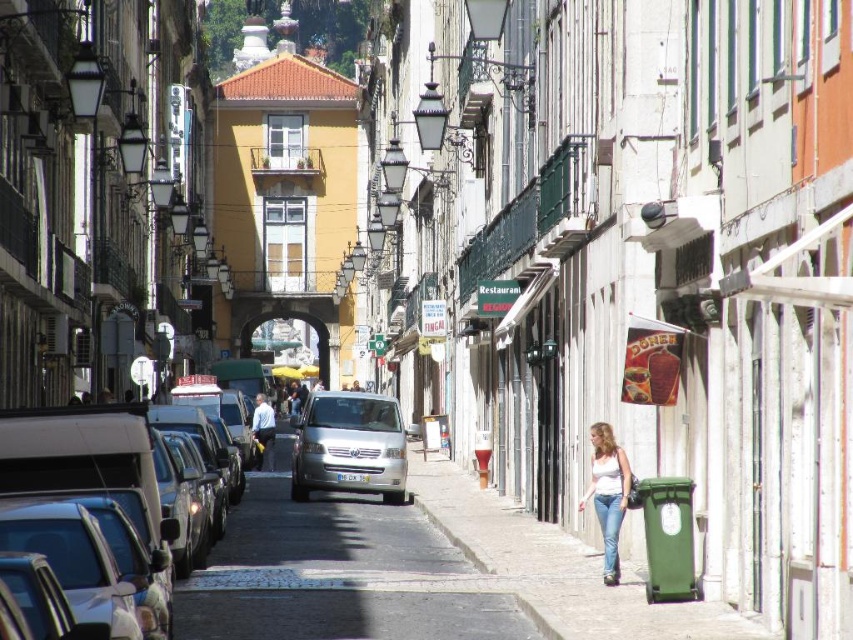
Question: Which is farther from the denim jeans at lower right?

Choices:
 (A) white cotton tank top at center-right
 (B) silver metallic van at center
 (C) shiny silver van at center-left

Answer: (B)

Question: Which object is positioned farthest from the denim jeans at lower right?

Choices:
 (A) silver metallic van at center
 (B) white cotton tank top at center-right

Answer: (A)

Question: Is shiny silver van at center-left thinner than denim jeans at lower right?

Choices:
 (A) no
 (B) yes

Answer: (A)

Question: Which point is closer to the camera?

Choices:
 (A) shiny silver van at center-left
 (B) white cotton tank top at center-right
 (C) denim jeans at lower right

Answer: (A)

Question: Does shiny silver van at center-left have a larger size compared to denim jeans at lower right?

Choices:
 (A) yes
 (B) no

Answer: (A)

Question: In this image, where is white cotton tank top at center-right located relative to denim jeans at lower right?

Choices:
 (A) below
 (B) above

Answer: (B)